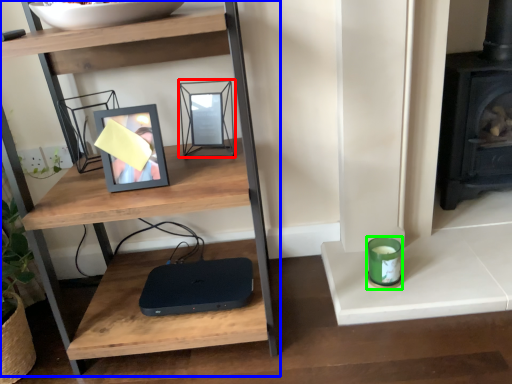
Question: Which object is positioned closest to picture frame (highlighted by a red box)? Select from shelf (highlighted by a blue box) and candle holder (highlighted by a green box).

Choices:
 (A) shelf
 (B) candle holder

Answer: (A)